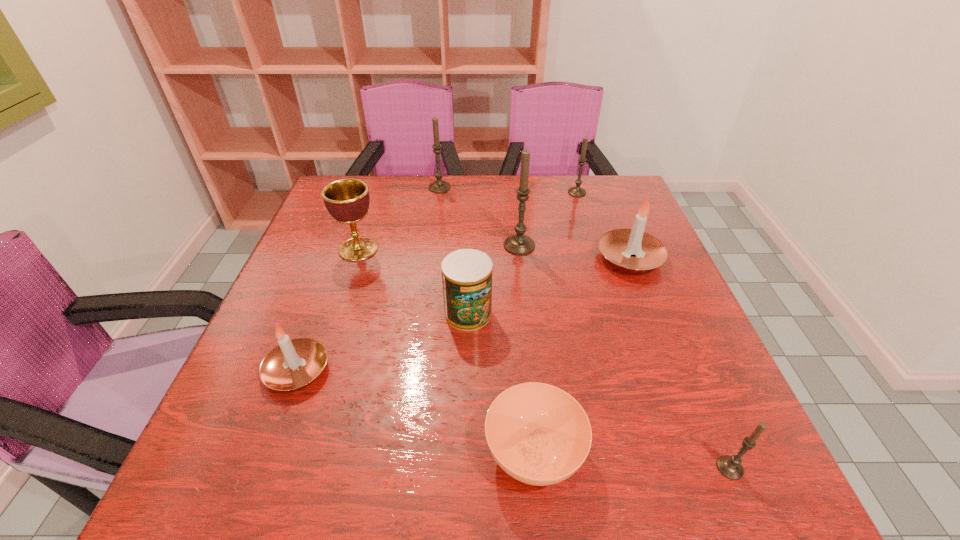
Where is `vacant point located between the fourth nearest object and the peach soup bowl`? vacant point located between the fourth nearest object and the peach soup bowl is located at coordinates (501, 383).

Image resolution: width=960 pixels, height=540 pixels. Identify the location of free space between the tallest candle and the third biggest gray candle. (548, 219).

Locate an element on the screen. This screenshot has height=540, width=960. free spot between the chalice and the farther white candle is located at coordinates tap(494, 253).

Where is `free spot between the peach soup bowl and the golden chalice`? free spot between the peach soup bowl and the golden chalice is located at coordinates (446, 351).

Locate an element on the screen. This screenshot has height=540, width=960. free point between the right white candle and the fourth candle from right to left is located at coordinates click(574, 252).

The image size is (960, 540). In order to click on blank region between the golden chalice and the rightmost gray candle in this screenshot , I will do `click(544, 359)`.

Select which object appears as the fourth closest to the smallest gray candle. Please provide its 2D coordinates. Your answer should be formatted as a tuple, i.e. [(x, y)], where the tuple contains the x and y coordinates of a point satisfying the conditions above.

[(519, 244)]

Where is `object that is the eighth closest to the fifth candle from right to left`? object that is the eighth closest to the fifth candle from right to left is located at coordinates (730, 466).

Identify which candle is the third closest to the third farthest gray candle. Please provide its 2D coordinates. Your answer should be formatted as a tuple, i.e. [(x, y)], where the tuple contains the x and y coordinates of a point satisfying the conditions above.

[(439, 186)]

Identify which candle is the second closest to the nearer white candle. Please provide its 2D coordinates. Your answer should be formatted as a tuple, i.e. [(x, y)], where the tuple contains the x and y coordinates of a point satisfying the conditions above.

[(439, 186)]